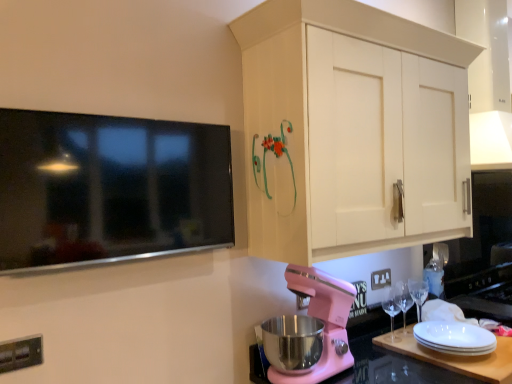
Question: From the image's perspective, is white matte cabinet at upper right over metallic silver electric outlet at lower left, the 2th electric outlet positioned from the back?

Choices:
 (A) yes
 (B) no

Answer: (A)

Question: Is white matte cabinet at upper right further to the viewer compared to metallic silver electric outlet at lower left, the 1th electric outlet positioned from the front?

Choices:
 (A) no
 (B) yes

Answer: (B)

Question: Are white matte cabinet at upper right and metallic silver electric outlet at lower left, the 2th electric outlet positioned from the back, far apart?

Choices:
 (A) yes
 (B) no

Answer: (A)

Question: Is white matte cabinet at upper right closer to the viewer compared to metallic silver electric outlet at lower left, the 2th electric outlet positioned from the back?

Choices:
 (A) yes
 (B) no

Answer: (B)

Question: Is white matte cabinet at upper right wider than metallic silver electric outlet at lower left, the 1th electric outlet positioned from the front?

Choices:
 (A) yes
 (B) no

Answer: (A)

Question: Does white matte cabinet at upper right have a lesser width compared to metallic silver electric outlet at lower left, which appears as the first electric outlet when viewed from the left?

Choices:
 (A) no
 (B) yes

Answer: (A)

Question: Considering the relative sizes of transparent glass wine glass at lower right, which is counted as the 2th wine glass, starting from the left, and pink matte stand mixer at lower center in the image provided, is transparent glass wine glass at lower right, which is counted as the 2th wine glass, starting from the left, smaller than pink matte stand mixer at lower center?

Choices:
 (A) no
 (B) yes

Answer: (B)

Question: From the image's perspective, is transparent glass wine glass at lower right, the 1th wine glass from the right, located above pink matte stand mixer at lower center?

Choices:
 (A) yes
 (B) no

Answer: (B)

Question: Is transparent glass wine glass at lower right, the 1th wine glass from the right, facing towards pink matte stand mixer at lower center?

Choices:
 (A) yes
 (B) no

Answer: (B)

Question: Is transparent glass wine glass at lower right, which is counted as the 2th wine glass, starting from the left, looking in the opposite direction of pink matte stand mixer at lower center?

Choices:
 (A) no
 (B) yes

Answer: (A)

Question: From a real-world perspective, is transparent glass wine glass at lower right, the 1th wine glass from the right, physically above pink matte stand mixer at lower center?

Choices:
 (A) no
 (B) yes

Answer: (A)

Question: Does transparent glass wine glass at lower right, which is counted as the 2th wine glass, starting from the left, appear on the left side of pink matte stand mixer at lower center?

Choices:
 (A) yes
 (B) no

Answer: (B)

Question: Is clear glass wine glass at lower right, the second wine glass positioned from the right, surrounded by flat screen tv at upper left?

Choices:
 (A) yes
 (B) no

Answer: (B)